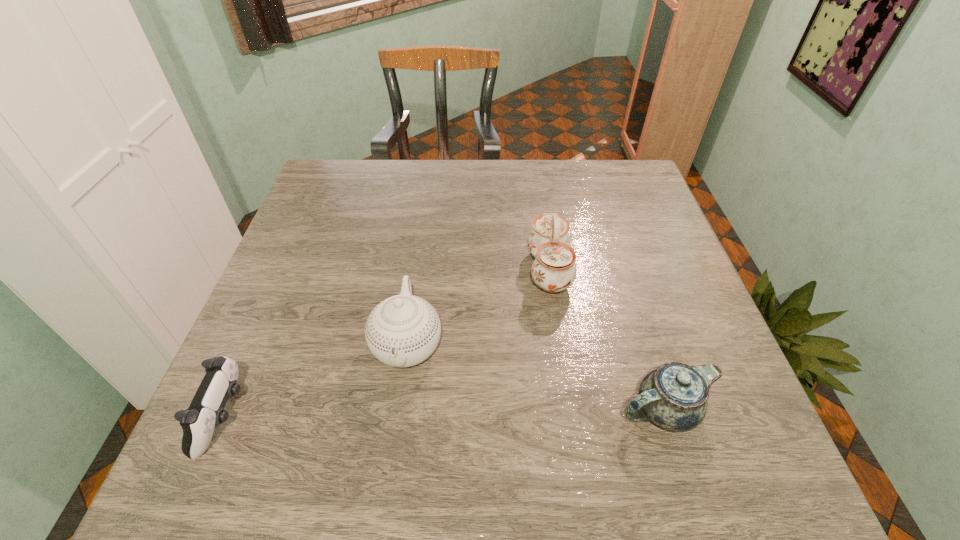
Identify the location of vacant space at the far edge. (374, 195).

Locate an element on the screen. The width and height of the screenshot is (960, 540). free space at the near edge of the desktop is located at coordinates (582, 442).

This screenshot has width=960, height=540. In the image, there is a desktop. In order to click on vacant region at the left edge in this screenshot , I will do `click(308, 371)`.

At what (x,y) coordinates should I click in order to perform the action: click on blank space at the right edge. Please return your answer as a coordinate pair (x, y). The image size is (960, 540). Looking at the image, I should click on 671,316.

Where is `vacant region at the far right corner`? This screenshot has height=540, width=960. vacant region at the far right corner is located at coordinates (619, 159).

At what (x,y) coordinates should I click in order to perform the action: click on free space between the control and the rightmost chinaware. Please return your answer as a coordinate pair (x, y). This screenshot has width=960, height=540. Looking at the image, I should click on (444, 413).

Where is `unoccupied area between the rightmost object and the control`? This screenshot has width=960, height=540. unoccupied area between the rightmost object and the control is located at coordinates (444, 413).

Image resolution: width=960 pixels, height=540 pixels. In order to click on vacant space that's between the leftmost object and the leftmost chinaware in this screenshot , I will do `click(316, 381)`.

At what (x,y) coordinates should I click in order to perform the action: click on free space between the rightmost chinaware and the leftmost object. Please return your answer as a coordinate pair (x, y). Looking at the image, I should click on (444, 413).

This screenshot has width=960, height=540. In order to click on free space between the rightmost object and the second chinaware from left to right in this screenshot , I will do `click(607, 340)`.